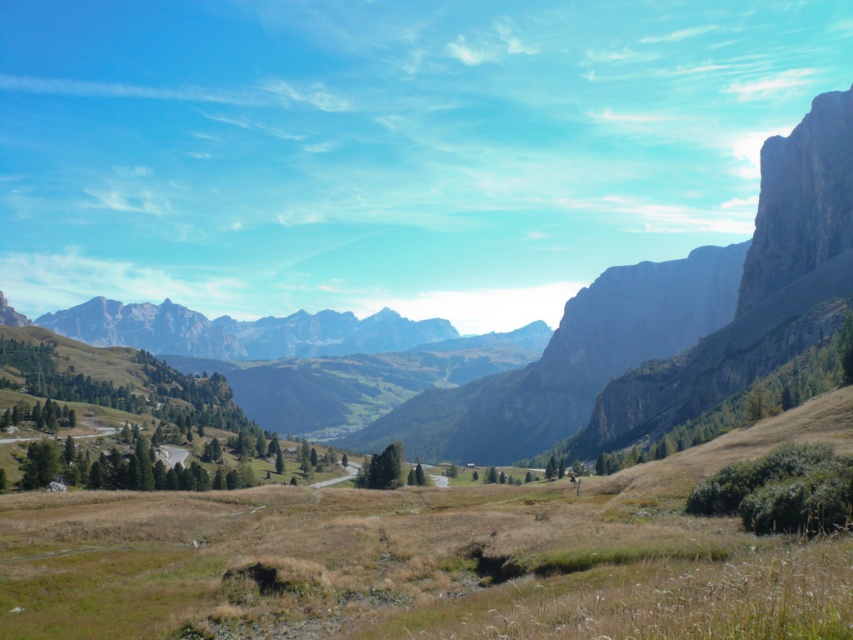
Question: Which point is farther to the camera?

Choices:
 (A) dry grass at center
 (B) rocky gray mountain range at center

Answer: (B)

Question: Observing the image, what is the correct spatial positioning of dry grass at center in reference to rocky gray mountain range at center?

Choices:
 (A) left
 (B) right

Answer: (A)

Question: Which of the following is the closest to the observer?

Choices:
 (A) dry grass at center
 (B) rocky gray mountain range at center

Answer: (A)

Question: Does dry grass at center have a lesser width compared to rocky gray mountain range at center?

Choices:
 (A) yes
 (B) no

Answer: (A)

Question: Is dry grass at center to the left of rocky gray mountain range at center from the viewer's perspective?

Choices:
 (A) yes
 (B) no

Answer: (A)